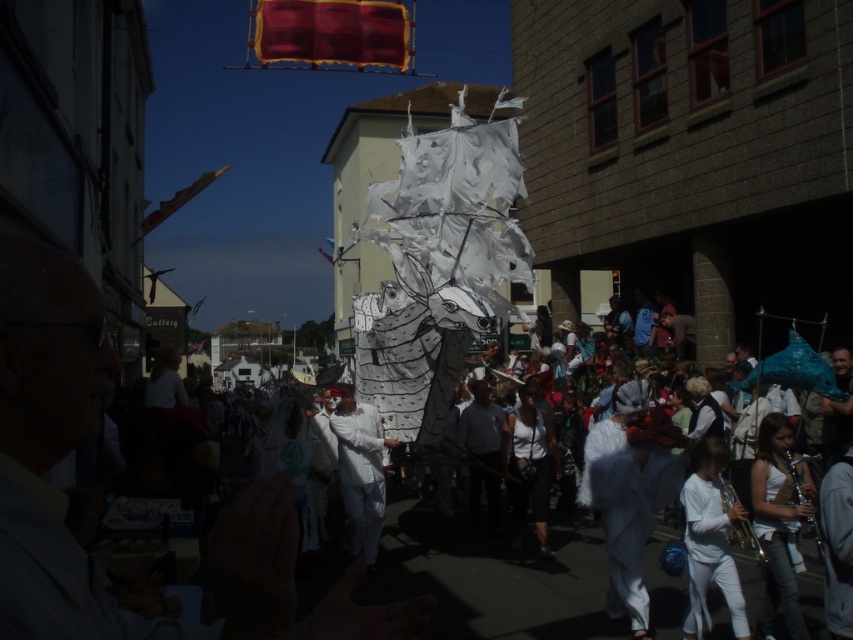
You are a photographer positioned at the center of the street during the parade. You want to capture a photo of the white paper dragon at center without including the building on the left side. Is the dragon positioned in a way that allows this?

The white paper dragon at center is located at point (360, 468), which is away from the building on the left side. Therefore, you can position yourself to capture the dragon without including the building.

You are a photographer standing at the front of the ship in the parade. You want to take a photo that includes both the ship and the building with signage on the left side of the street. The two points you are focusing on are point (86,636) and point (486,403). Which point should you focus on to ensure both the ship and the building are in sharp focus?

You should focus on point (86,636) because it is closer to the camera than point (486,403). This will ensure the ship, which is closer, and the building on the left, which is farther away, are both in focus.